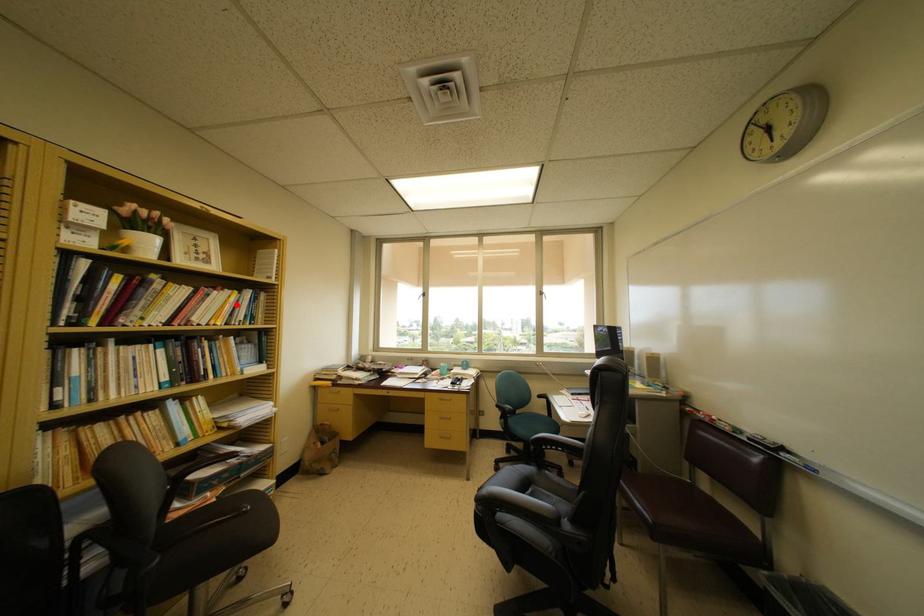
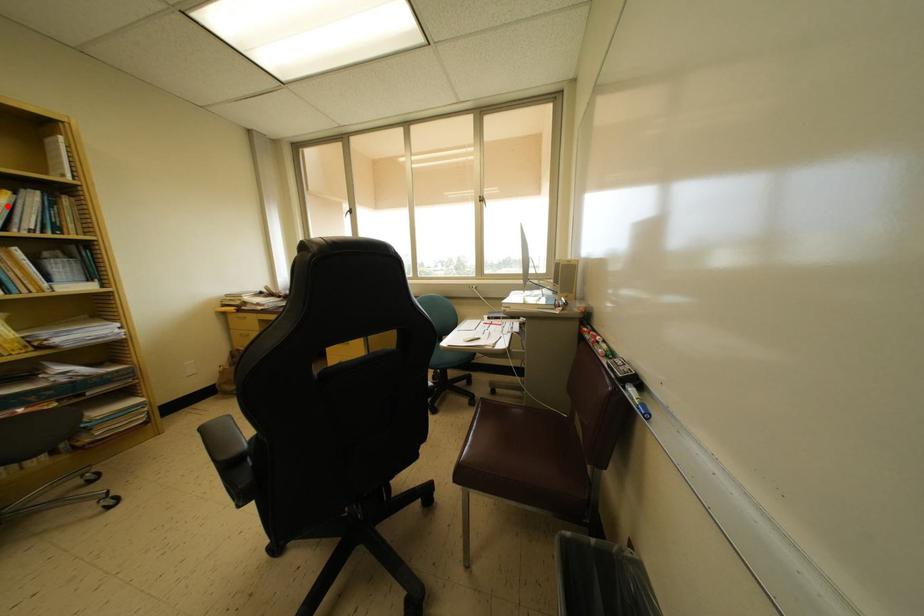
I am providing you with two images of the same scene from different viewpoints. A red point is marked on the first image and another point is marked on the second image. Does the point marked in image1 correspond to the same location as the one in image2?

Yes